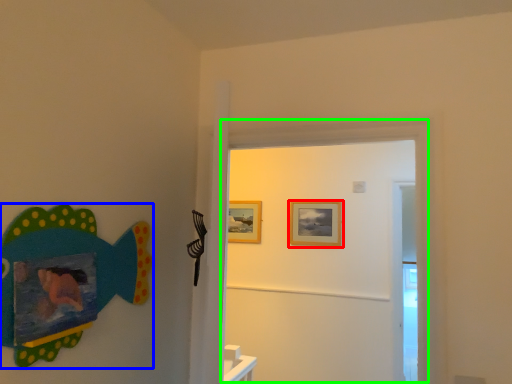
Question: Which is farther away from picture frame (highlighted by a red box)? fish (highlighted by a blue box) or door (highlighted by a green box)?

Choices:
 (A) fish
 (B) door

Answer: (A)